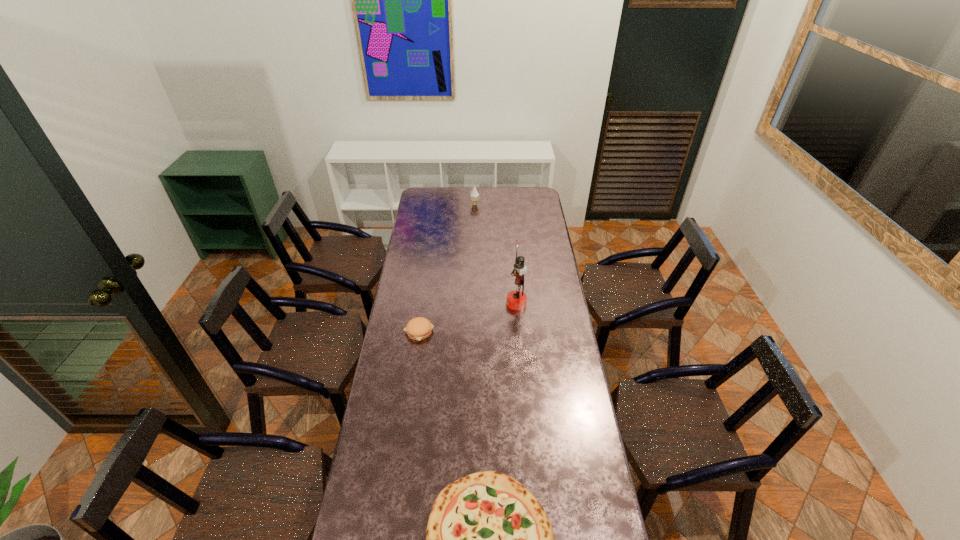
Where is `empty space between the third nearest object and the third shortest object`? The width and height of the screenshot is (960, 540). empty space between the third nearest object and the third shortest object is located at coordinates (495, 254).

Identify the location of free spot between the farthest object and the patty. (446, 268).

You are a GUI agent. You are given a task and a screenshot of the screen. Output one action in this format:
    pyautogui.click(x=<x>, y=<y>)
    Task: Click on the object identified as the second closest to the pizza
    
    Given the screenshot: What is the action you would take?
    pyautogui.click(x=516, y=300)

The image size is (960, 540). I want to click on the second closest object to the leftmost object, so pyautogui.click(x=488, y=539).